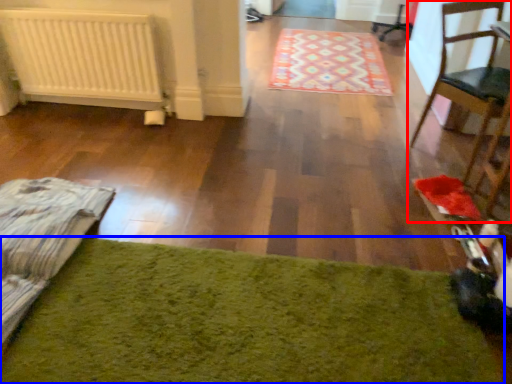
Question: Which of the following is the farthest to the observer, chair (highlighted by a red box) or mat (highlighted by a blue box)?

Choices:
 (A) chair
 (B) mat

Answer: (A)